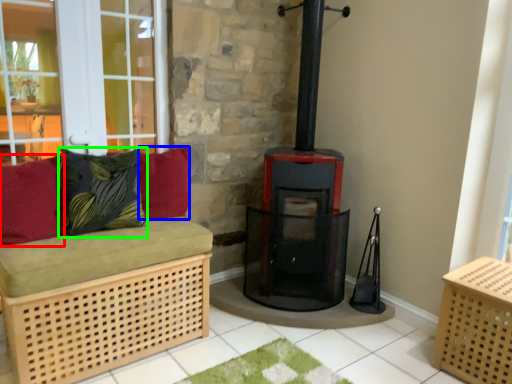
Question: Which object is positioned farthest from pillow (highlighted by a red box)? Select from pillow (highlighted by a blue box) and pillow (highlighted by a green box).

Choices:
 (A) pillow
 (B) pillow

Answer: (A)